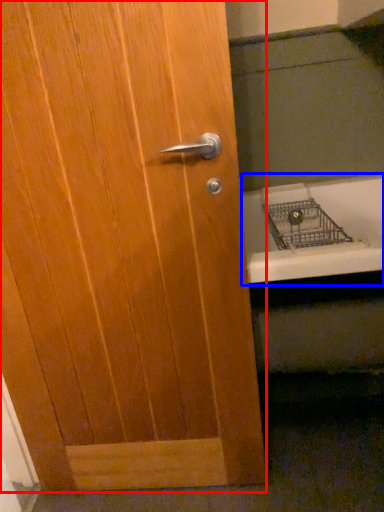
Question: Which point is further to the camera, door (highlighted by a red box) or bath (highlighted by a blue box)?

Choices:
 (A) door
 (B) bath

Answer: (B)